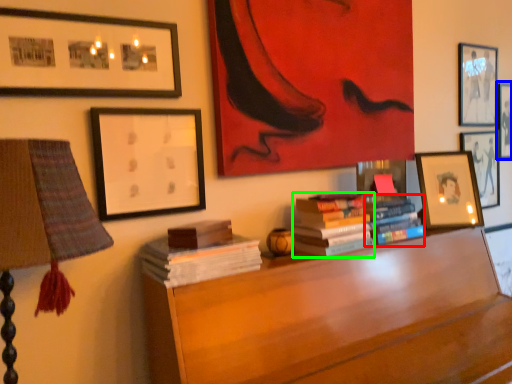
Question: Based on their relative distances, which object is nearer to book (highlighted by a red box)? Choose from picture frame (highlighted by a blue box) and book (highlighted by a green box).

Choices:
 (A) picture frame
 (B) book

Answer: (B)